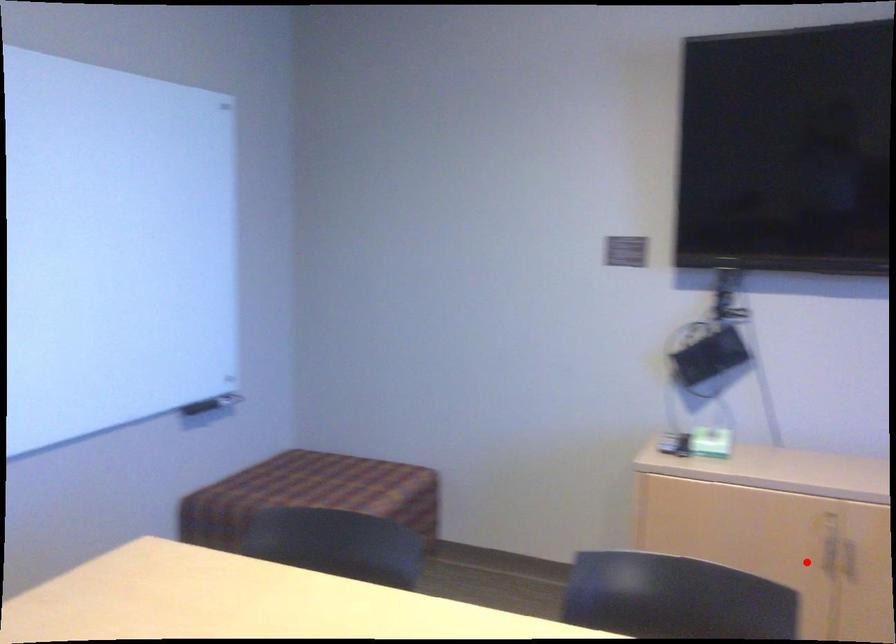
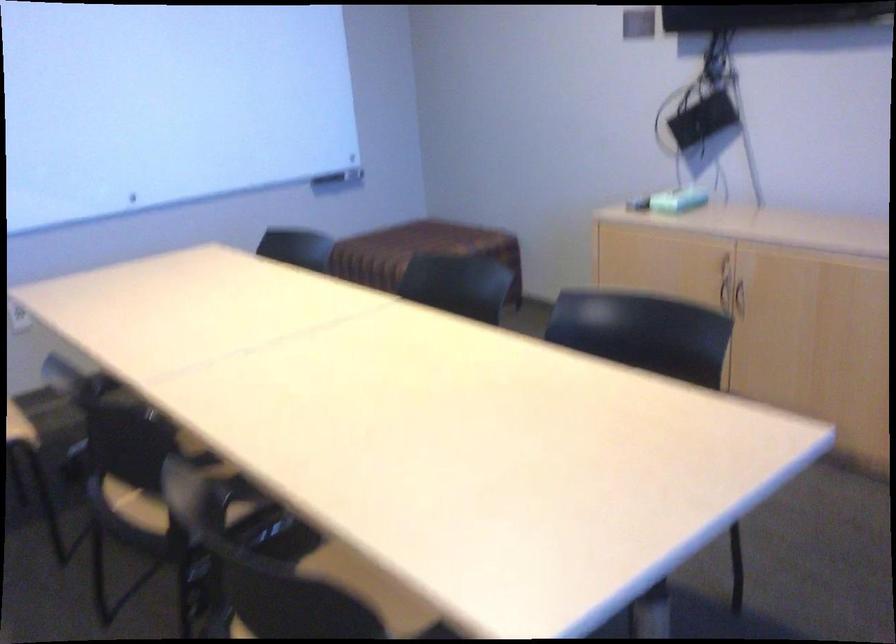
Locate, in the second image, the point that corresponds to the highlighted location in the first image.

(725, 295)